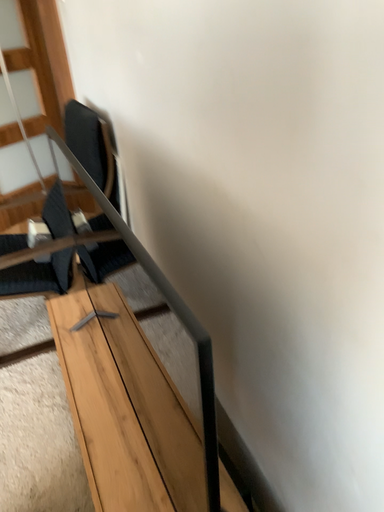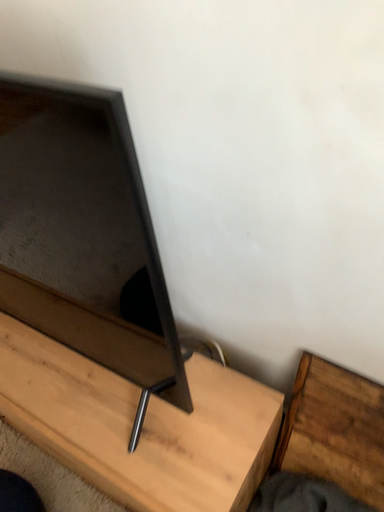
Question: Which way did the camera rotate in the video?

Choices:
 (A) rotated upward
 (B) rotated downward

Answer: (B)